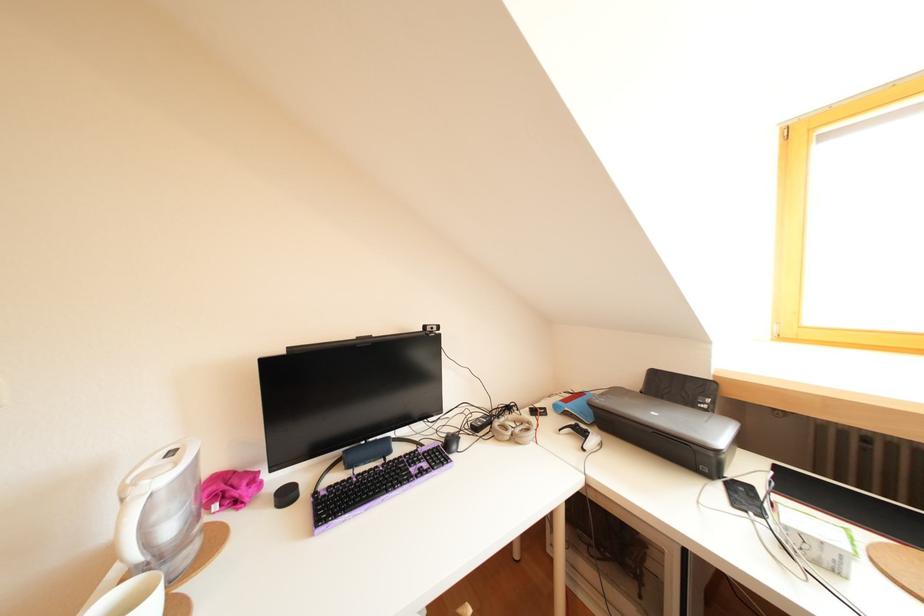
Where is `black smartphone`? The height and width of the screenshot is (616, 924). black smartphone is located at coordinates (744, 496).